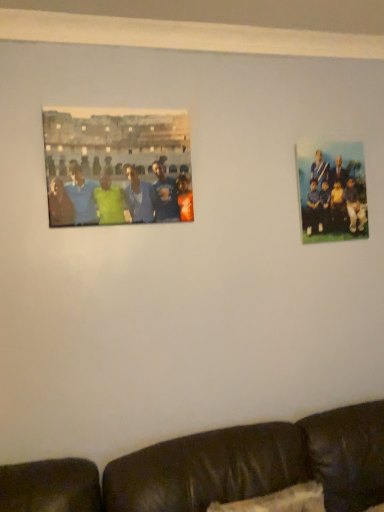
In order to click on matte plastic photo at upper left in this screenshot , I will do tap(117, 166).

This screenshot has height=512, width=384. Describe the element at coordinates (117, 166) in the screenshot. I see `matte plastic photo at upper left` at that location.

The height and width of the screenshot is (512, 384). Identify the location of formal attire group at upper right. (333, 193).

This screenshot has width=384, height=512. Describe the element at coordinates (333, 193) in the screenshot. I see `formal attire group at upper right` at that location.

Locate an element on the screen. matte plastic photo at upper left is located at coordinates (117, 166).

Considering the positions of objects formal attire group at upper right and matte plastic photo at upper left in the image provided, who is more to the right, formal attire group at upper right or matte plastic photo at upper left?

formal attire group at upper right is more to the right.

In the image, is formal attire group at upper right positioned in front of or behind matte plastic photo at upper left?

formal attire group at upper right is behind matte plastic photo at upper left.

Which is closer to the camera, [320,219] or [144,145]?

Point [320,219].

From the image's perspective, does formal attire group at upper right appear lower than matte plastic photo at upper left?

Yes, from the image's perspective, formal attire group at upper right is below matte plastic photo at upper left.

From a real-world perspective, is formal attire group at upper right on matte plastic photo at upper left?

No.

Which object is thinner, formal attire group at upper right or matte plastic photo at upper left?

With smaller width is formal attire group at upper right.

In terms of height, does formal attire group at upper right look taller or shorter compared to matte plastic photo at upper left?

Considering their sizes, formal attire group at upper right has more height than matte plastic photo at upper left.

Can you confirm if formal attire group at upper right is smaller than matte plastic photo at upper left?

Indeed, formal attire group at upper right has a smaller size compared to matte plastic photo at upper left.

Would you say matte plastic photo at upper left is part of formal attire group at upper right's contents?

No, matte plastic photo at upper left is not inside formal attire group at upper right.

Is formal attire group at upper right next to matte plastic photo at upper left?

No, formal attire group at upper right is not with matte plastic photo at upper left.

Is formal attire group at upper right positioned with its back to matte plastic photo at upper left?

formal attire group at upper right is not turned away from matte plastic photo at upper left.

Measure the distance from formal attire group at upper right to matte plastic photo at upper left.

26.29 inches.

This screenshot has height=512, width=384. Find the location of `picture frame in front of the formal attire group at upper right`. picture frame in front of the formal attire group at upper right is located at coordinates (117, 166).

Can you confirm if matte plastic photo at upper left is positioned to the right of formal attire group at upper right?

In fact, matte plastic photo at upper left is to the left of formal attire group at upper right.

Is the position of matte plastic photo at upper left less distant than that of formal attire group at upper right?

Yes, matte plastic photo at upper left is closer to the viewer.

Which is closer to the camera, (92, 217) or (333, 182)?

Point (92, 217).

From the image's perspective, is matte plastic photo at upper left over formal attire group at upper right?

Correct, matte plastic photo at upper left appears higher than formal attire group at upper right in the image.

From a real-world perspective, is matte plastic photo at upper left located beneath formal attire group at upper right?

No.

Considering the sizes of objects matte plastic photo at upper left and formal attire group at upper right in the image provided, who is wider, matte plastic photo at upper left or formal attire group at upper right?

With larger width is matte plastic photo at upper left.

Is matte plastic photo at upper left taller than formal attire group at upper right?

No, matte plastic photo at upper left is not taller than formal attire group at upper right.

From the picture: Considering the relative sizes of matte plastic photo at upper left and formal attire group at upper right in the image provided, is matte plastic photo at upper left bigger than formal attire group at upper right?

Correct, matte plastic photo at upper left is larger in size than formal attire group at upper right.

Is matte plastic photo at upper left located outside formal attire group at upper right?

matte plastic photo at upper left lies outside formal attire group at upper right's area.

Is matte plastic photo at upper left directly adjacent to formal attire group at upper right?

No.

Is matte plastic photo at upper left positioned with its back to formal attire group at upper right?

No, matte plastic photo at upper left is not facing the opposite direction of formal attire group at upper right.

How many degrees apart are the facing directions of matte plastic photo at upper left and formal attire group at upper right?

They differ by 0.00555 degrees in their facing directions.

At what (x,y) coordinates should I click in order to perform the action: click on picture frame in front of the formal attire group at upper right. Please return your answer as a coordinate pair (x, y). This screenshot has height=512, width=384. Looking at the image, I should click on (117, 166).

Image resolution: width=384 pixels, height=512 pixels. Identify the location of picture frame above the formal attire group at upper right (from the image's perspective). (117, 166).

Where is `person below the matte plastic photo at upper left (from a real-world perspective)`? The width and height of the screenshot is (384, 512). person below the matte plastic photo at upper left (from a real-world perspective) is located at coordinates (333, 193).